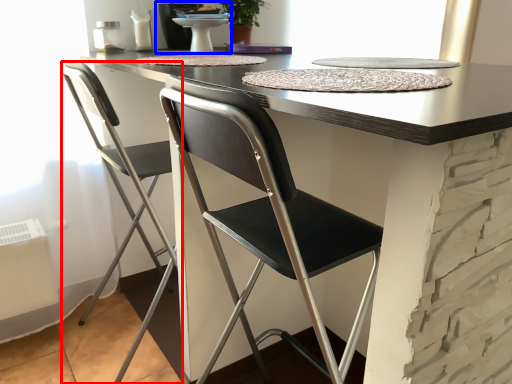
Question: Which of the following is the closest to the observer, chair (highlighted by a red box) or sink (highlighted by a blue box)?

Choices:
 (A) chair
 (B) sink

Answer: (A)